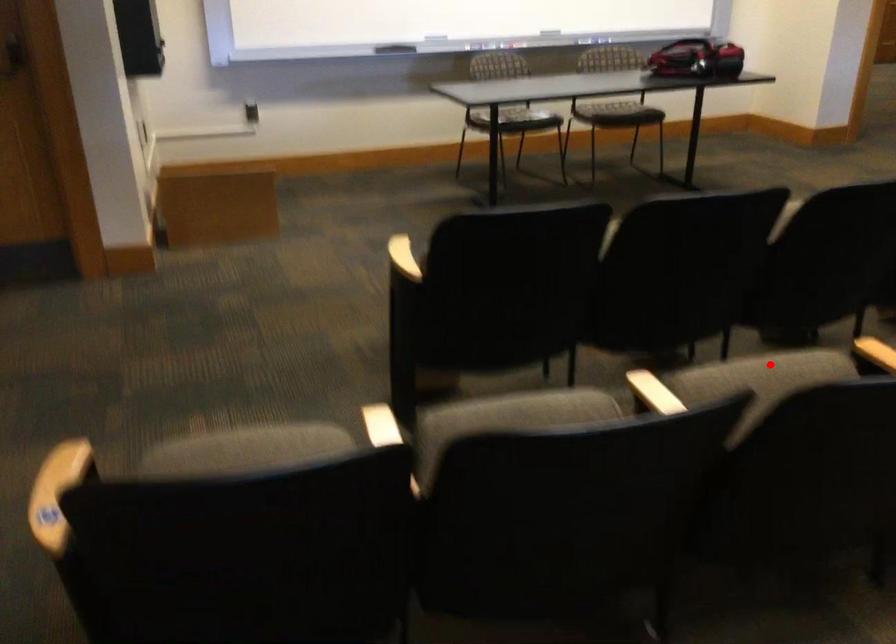
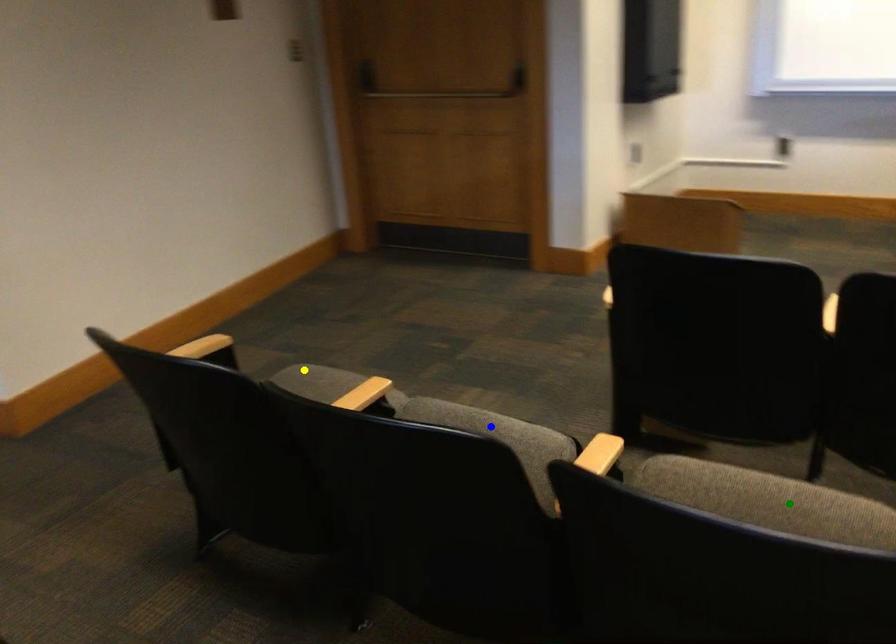
Question: I am providing you with two images of the same scene from different viewpoints. A red point is marked on the first image. You are given multiple points on the second image. Which point in image 2 represents the same 3d spot as the red point in image 1?

Choices:
 (A) blue point
 (B) green point
 (C) yellow point

Answer: (B)